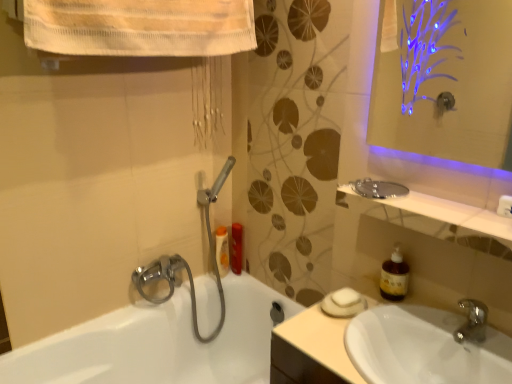
Locate an element on the screen. The width and height of the screenshot is (512, 384). free spot in front of brown translucent soap dispenser at right is located at coordinates (398, 330).